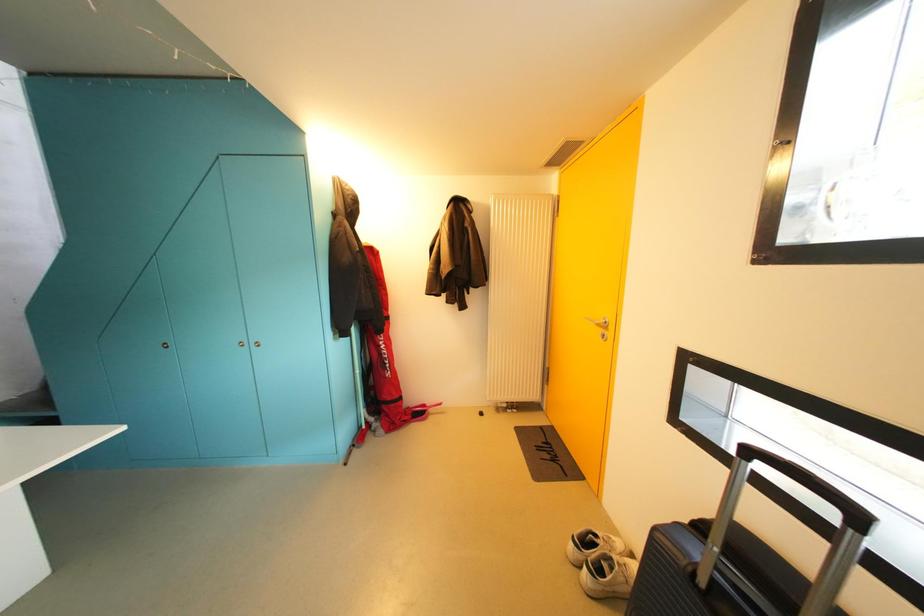
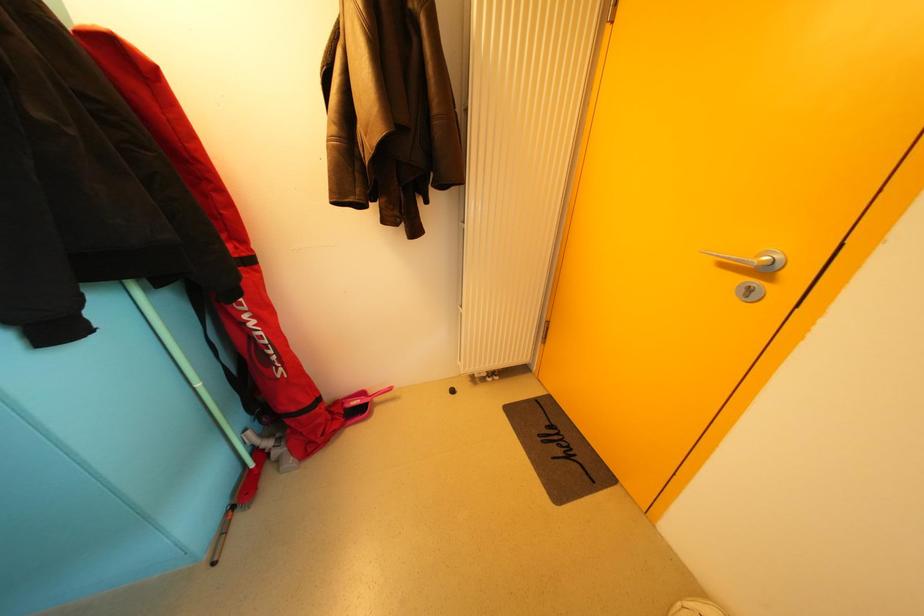
Question: Based on the continuous images, in which direction is the camera rotating? Reply with the corresponding letter.

Choices:
 (A) Left
 (B) Right
 (C) Up
 (D) Down

Answer: (D)